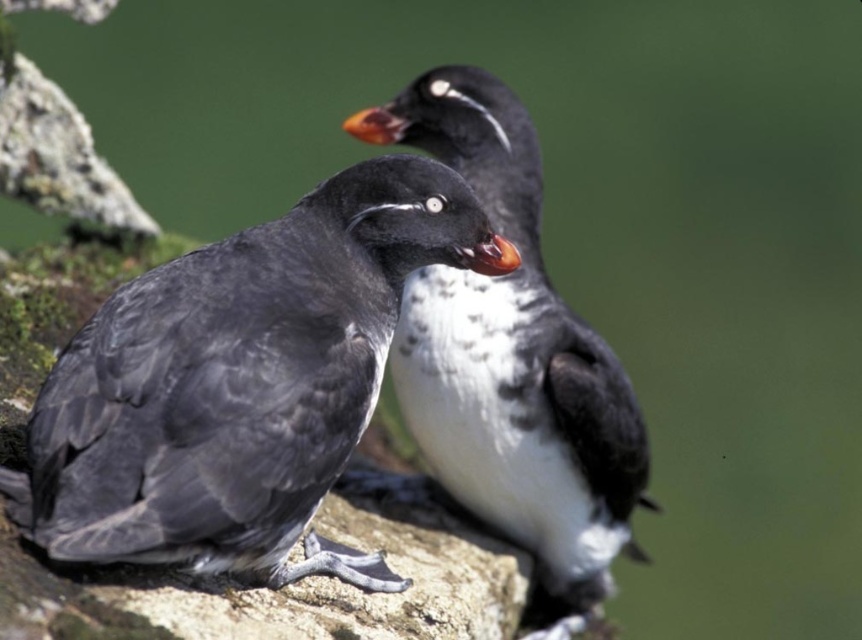
Is point (97, 440) closer to viewer compared to point (417, 362)?

Yes, point (97, 440) is in front of point (417, 362).

Which of these two, matte black bird at left or black feathered bird at center, stands shorter?

matte black bird at left is shorter.

Does point (173, 403) lie behind point (438, 464)?

No, (173, 403) is closer to viewer.

Identify the location of matte black bird at left. (241, 381).